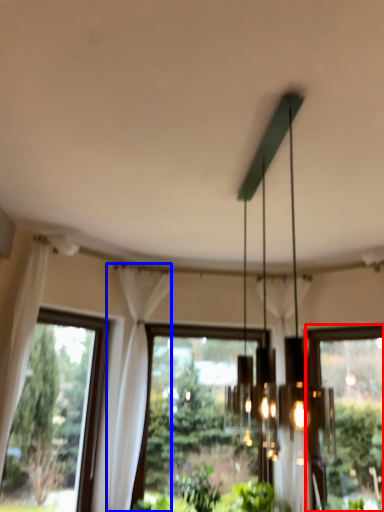
Question: Among these objects, which one is farthest to the camera, window (highlighted by a red box) or curtain (highlighted by a blue box)?

Choices:
 (A) window
 (B) curtain

Answer: (A)